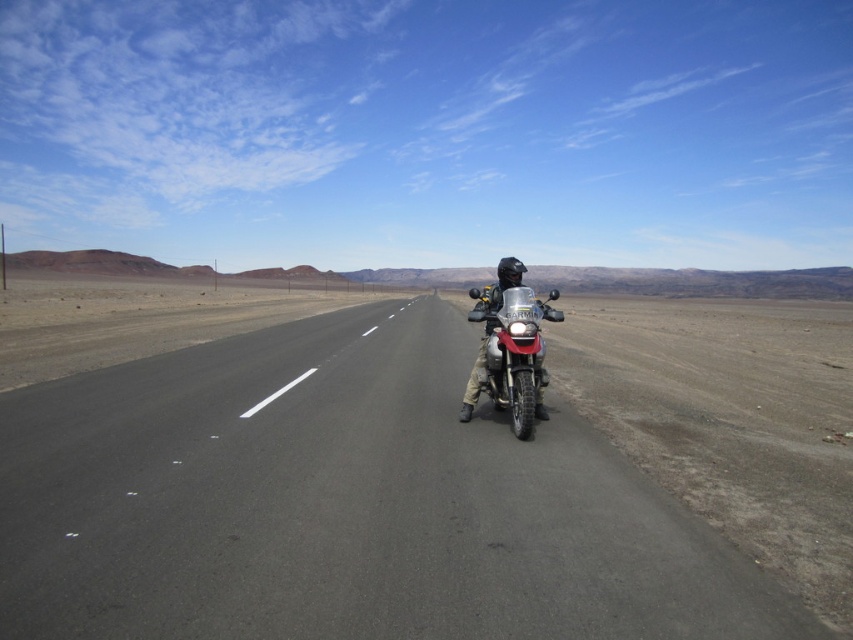
What do you see at coordinates (343, 504) in the screenshot? Image resolution: width=853 pixels, height=640 pixels. I see `asphalt road at center` at bounding box center [343, 504].

Does asphalt road at center appear on the right side of metallic silver motorcycle at center?

In fact, asphalt road at center is to the left of metallic silver motorcycle at center.

The width and height of the screenshot is (853, 640). Identify the location of asphalt road at center. (343, 504).